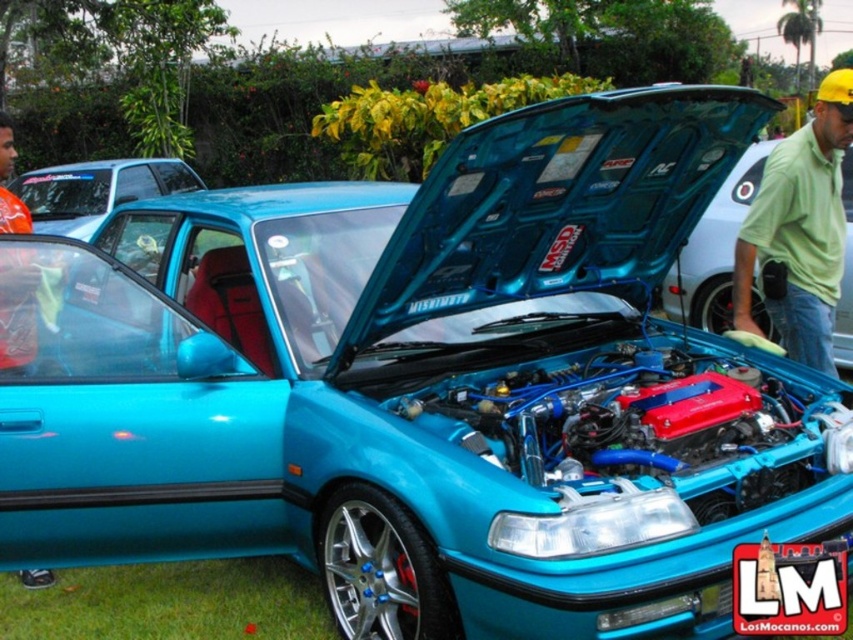
Who is lower down, green cotton shirt at upper right or orange fabric shirt at left?

orange fabric shirt at left is lower down.

Image resolution: width=853 pixels, height=640 pixels. Find the location of `green cotton shirt at upper right`. green cotton shirt at upper right is located at coordinates (799, 230).

Find the location of `green cotton shirt at upper right`. green cotton shirt at upper right is located at coordinates (799, 230).